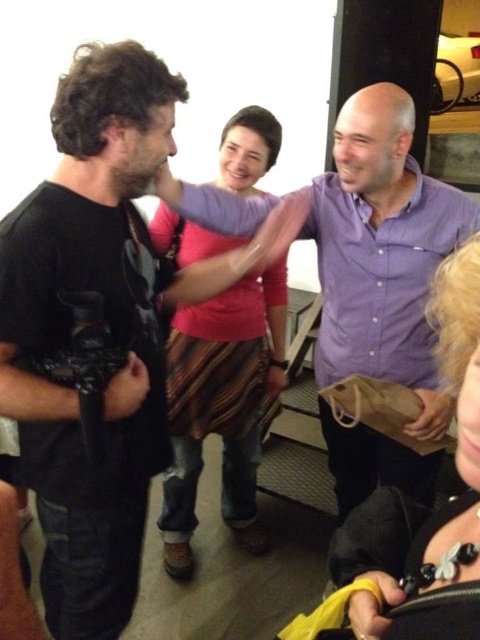
Question: Is purple button-down shirt at center in front of striped cotton skirt at center?

Choices:
 (A) yes
 (B) no

Answer: (A)

Question: Among these objects, which one is farthest from the camera?

Choices:
 (A) blonde hair at lower right
 (B) purple button-down shirt at center
 (C) black matte camera at left
 (D) striped cotton skirt at center

Answer: (D)

Question: Does purple button-down shirt at center have a smaller size compared to striped cotton skirt at center?

Choices:
 (A) no
 (B) yes

Answer: (A)

Question: Can you confirm if striped cotton skirt at center is positioned to the right of blonde hair at lower right?

Choices:
 (A) no
 (B) yes

Answer: (A)

Question: Which of these objects is positioned closest to the blonde hair at lower right?

Choices:
 (A) black matte camera at left
 (B) striped cotton skirt at center
 (C) purple button-down shirt at center

Answer: (A)

Question: Which of these objects is positioned farthest from the striped cotton skirt at center?

Choices:
 (A) black matte camera at left
 (B) purple button-down shirt at center

Answer: (A)